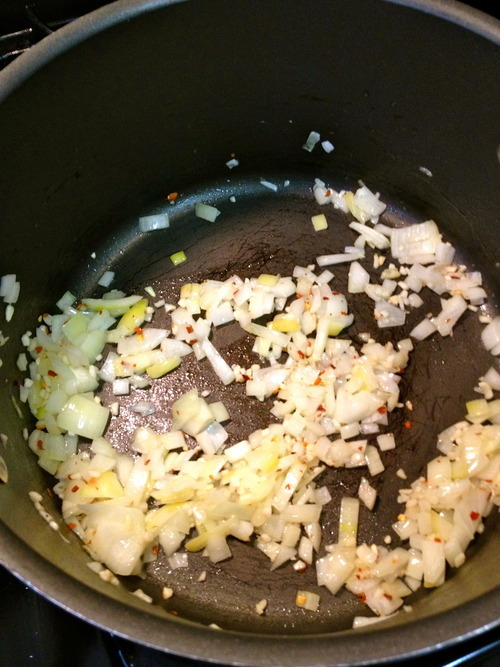
Where is `rim of frying pan`? rim of frying pan is located at coordinates (46, 49), (86, 614), (430, 647), (477, 21).